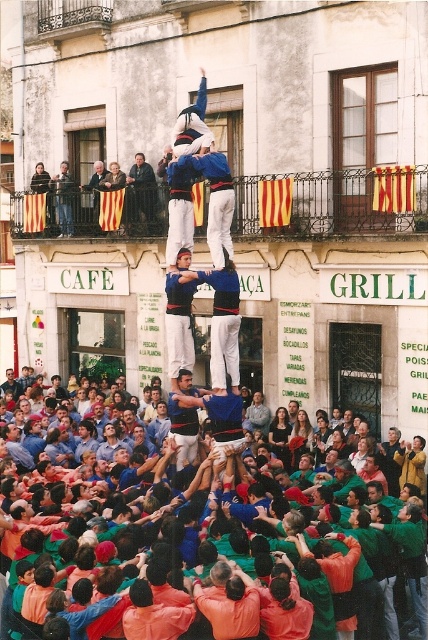
You are a photographer standing in front of the crowd. You want to take a photo of the dark blue suit at center and denim jeans at upper left. Which one should you zoom in on to capture the most detail?

The dark blue suit at center has a larger size compared to denim jeans at upper left, so you should zoom in on the dark blue suit at center to capture the most detail.

You are a photographer standing at the camera position. You want to capture a closeup shot of the dark blue suit at center. Given that your camera has a maximum zoom range of 60 meters, will you be able to zoom in enough to get a clear closeup?

The dark blue suit at center is 65.53 meters from camera, which is beyond the camera maximum zoom range of 60 meters. Therefore, you cannot zoom in enough to get a clear closeup.